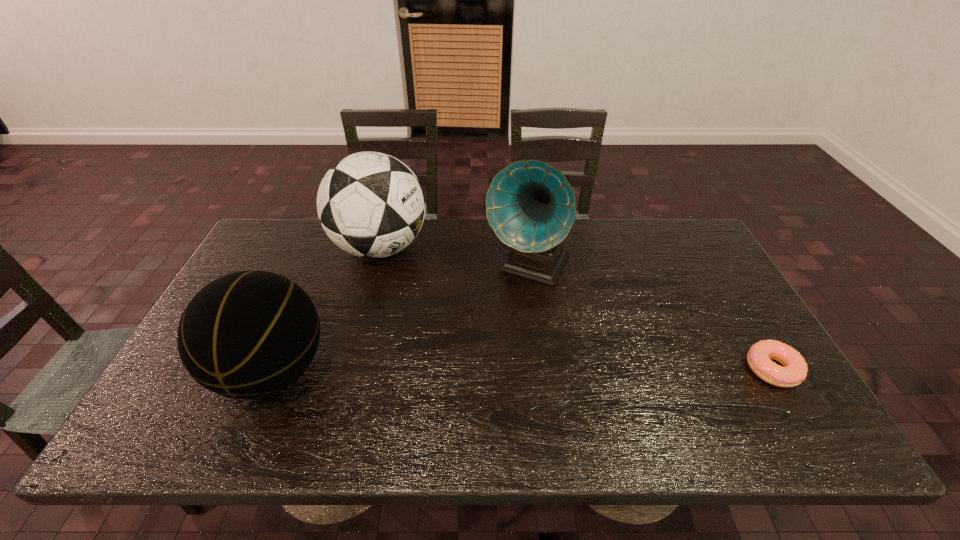
The height and width of the screenshot is (540, 960). I want to click on free point between the tallest object and the soccer ball, so click(x=454, y=258).

You are a GUI agent. You are given a task and a screenshot of the screen. Output one action in this format:
    pyautogui.click(x=<x>, y=<y>)
    Task: Click on the vacant area that lies between the basketball and the tallest object
    Image resolution: width=960 pixels, height=540 pixels.
    Given the screenshot: What is the action you would take?
    pyautogui.click(x=400, y=320)

At what (x,y) coordinates should I click in order to perform the action: click on unoccupied area between the second object from right to left and the soccer ball. Please return your answer as a coordinate pair (x, y). Looking at the image, I should click on (454, 258).

This screenshot has height=540, width=960. Find the location of `unoccupied position between the basketball and the rightmost object`. unoccupied position between the basketball and the rightmost object is located at coordinates (522, 370).

At what (x,y) coordinates should I click in order to perform the action: click on free spot between the tallest object and the soccer ball. Please return your answer as a coordinate pair (x, y). Looking at the image, I should click on (454, 258).

Find the location of a particular element. The height and width of the screenshot is (540, 960). empty location between the basketball and the soccer ball is located at coordinates (326, 309).

Where is `free space that is in between the soccer ball and the third object from left to right`? Image resolution: width=960 pixels, height=540 pixels. free space that is in between the soccer ball and the third object from left to right is located at coordinates (454, 258).

Where is `the closest object to the basketball`? the closest object to the basketball is located at coordinates (371, 205).

Choose which object is the third nearest neighbor to the doughnut. Please provide its 2D coordinates. Your answer should be formatted as a tuple, i.e. [(x, y)], where the tuple contains the x and y coordinates of a point satisfying the conditions above.

[(250, 334)]

The image size is (960, 540). I want to click on free space that satisfies the following two spatial constraints: 1. on the back side of the basketball; 2. on the right side of the second object from right to left, so click(x=316, y=267).